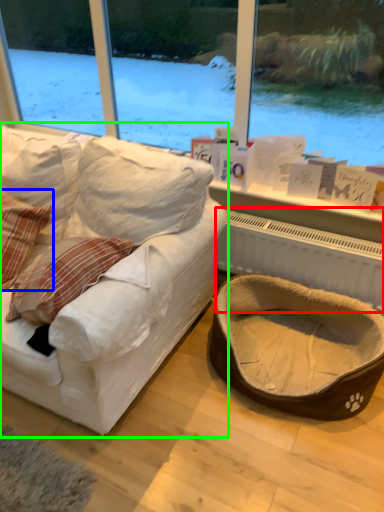
Question: Considering the real-world distances, which object is closest to radiator (highlighted by a red box)? pillow (highlighted by a blue box) or studio couch (highlighted by a green box).

Choices:
 (A) pillow
 (B) studio couch

Answer: (B)